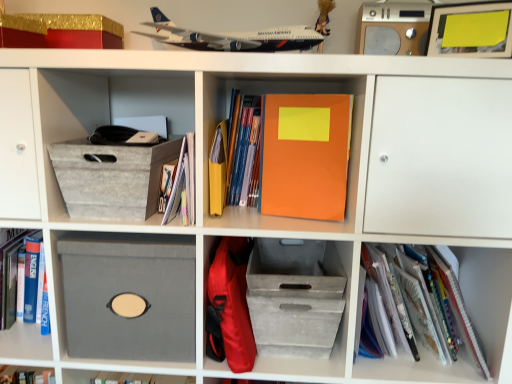
Question: Is the position of silver metallic speaker at upper right less distant than that of matte yellow paper at center, the first paperback book from the left?

Choices:
 (A) no
 (B) yes

Answer: (A)

Question: Does silver metallic speaker at upper right have a lesser height compared to matte yellow paper at center, the 2th paperback book positioned from the right?

Choices:
 (A) yes
 (B) no

Answer: (A)

Question: Can you confirm if silver metallic speaker at upper right is wider than matte yellow paper at center, the first paperback book from the left?

Choices:
 (A) no
 (B) yes

Answer: (B)

Question: Is silver metallic speaker at upper right not near matte yellow paper at center, the 2th paperback book positioned from the right?

Choices:
 (A) yes
 (B) no

Answer: (B)

Question: From a real-world perspective, does silver metallic speaker at upper right sit lower than matte yellow paper at center, the first paperback book from the left?

Choices:
 (A) no
 (B) yes

Answer: (A)

Question: Considering the positions of orange matte notebook at center, the 1th paperback book when ordered from right to left, and matte yellow paper at center, the 2th paperback book positioned from the right, in the image, is orange matte notebook at center, the 1th paperback book when ordered from right to left, taller or shorter than matte yellow paper at center, the 2th paperback book positioned from the right,?

Choices:
 (A) tall
 (B) short

Answer: (A)

Question: Looking at the image, does orange matte notebook at center, which ranks as the second paperback book in left-to-right order, seem bigger or smaller compared to matte yellow paper at center, the 2th paperback book positioned from the right?

Choices:
 (A) big
 (B) small

Answer: (A)

Question: Considering the relative positions of orange matte notebook at center, the 1th paperback book when ordered from right to left, and matte yellow paper at center, the 2th paperback book positioned from the right, in the image provided, is orange matte notebook at center, the 1th paperback book when ordered from right to left, to the left or to the right of matte yellow paper at center, the 2th paperback book positioned from the right,?

Choices:
 (A) left
 (B) right

Answer: (B)

Question: Relative to matte yellow paper at center, the first paperback book from the left, is orange matte notebook at center, which ranks as the second paperback book in left-to-right order, in front or behind?

Choices:
 (A) behind
 (B) front

Answer: (B)

Question: From the image's perspective, relative to silver metallic speaker at upper right, is gray fabric storage box at left, acting as the first cardboard box starting from the top, above or below?

Choices:
 (A) above
 (B) below

Answer: (B)

Question: Is gray fabric storage box at left, the 2th cardboard box positioned from the bottom, situated inside silver metallic speaker at upper right or outside?

Choices:
 (A) inside
 (B) outside

Answer: (B)

Question: Considering their positions, is gray fabric storage box at left, the 2th cardboard box positioned from the bottom, located in front of or behind silver metallic speaker at upper right?

Choices:
 (A) behind
 (B) front

Answer: (B)

Question: In terms of size, does gray fabric storage box at left, acting as the first cardboard box starting from the top, appear bigger or smaller than silver metallic speaker at upper right?

Choices:
 (A) big
 (B) small

Answer: (A)

Question: Is white plastic airplane at upper center in front of or behind matte blue book at center, the second book when ordered from left to right, in the image?

Choices:
 (A) behind
 (B) front

Answer: (B)

Question: Is white plastic airplane at upper center bigger or smaller than matte blue book at center, which is counted as the second book, starting from the right?

Choices:
 (A) small
 (B) big

Answer: (B)